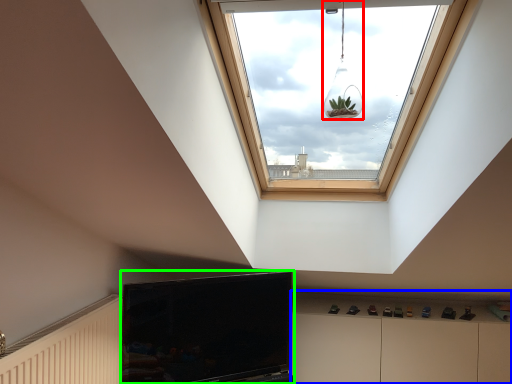
Question: Which is nearer to the light fixture (highlighted by a red box)? dresser (highlighted by a blue box) or television (highlighted by a green box).

Choices:
 (A) dresser
 (B) television

Answer: (B)